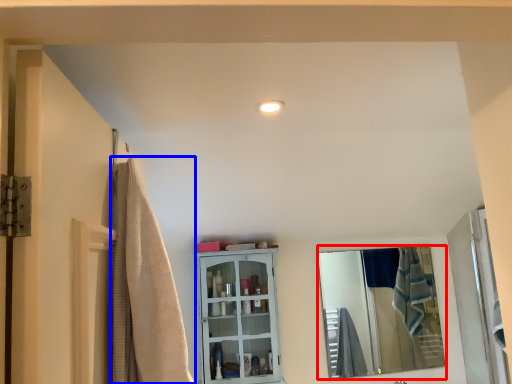
Question: Which object is further to the camera taking this photo, mirror (highlighted by a red box) or shower curtain (highlighted by a blue box)?

Choices:
 (A) mirror
 (B) shower curtain

Answer: (A)